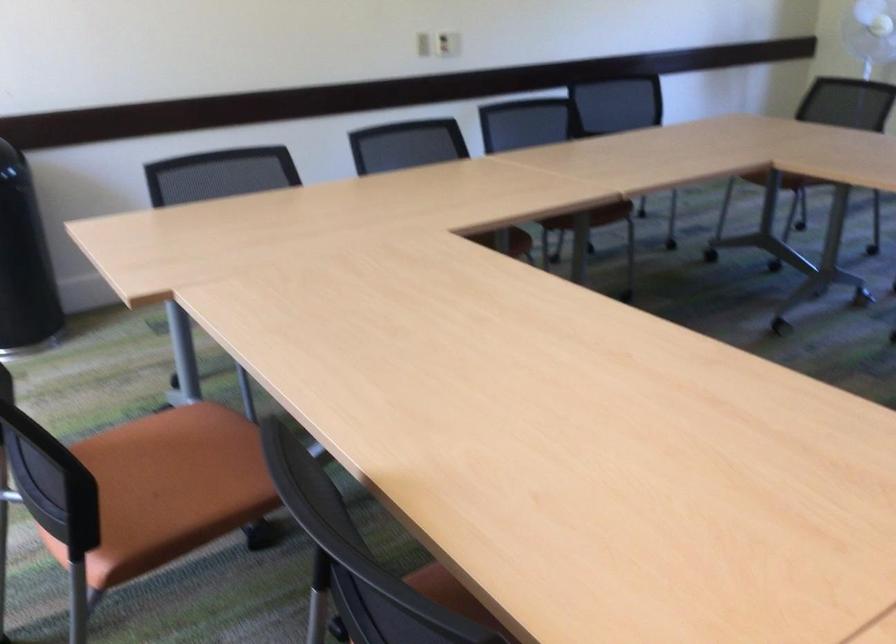
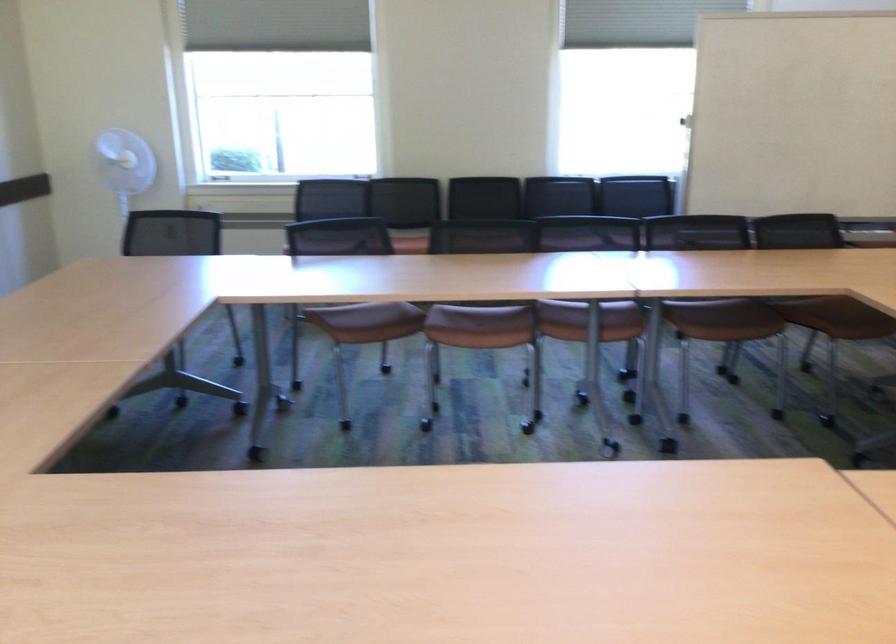
Find the pixel in the second image that matches [728,152] in the first image.

(177, 292)